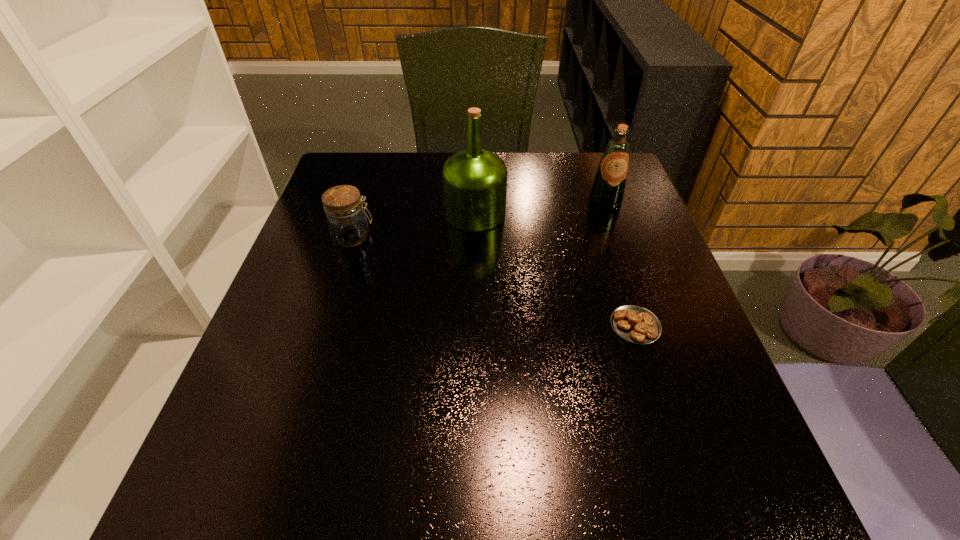
Identify which object is located as the nearest to the shortest object. Please provide its 2D coordinates. Your answer should be formatted as a tuple, i.e. [(x, y)], where the tuple contains the x and y coordinates of a point satisfying the conditions above.

[(474, 180)]

This screenshot has width=960, height=540. In order to click on vacant area in the image that satisfies the following two spatial constraints: 1. on the lid of the nearest object; 2. on the right side of the third tallest object in this screenshot , I will do `click(325, 326)`.

Locate an element on the screen. Image resolution: width=960 pixels, height=540 pixels. free space that satisfies the following two spatial constraints: 1. on the lid of the third tallest object; 2. on the right side of the shortest object is located at coordinates (325, 326).

Where is `vacant space that satisfies the following two spatial constraints: 1. on the front side of the tallest object; 2. on the right side of the pastry`? Image resolution: width=960 pixels, height=540 pixels. vacant space that satisfies the following two spatial constraints: 1. on the front side of the tallest object; 2. on the right side of the pastry is located at coordinates (474, 326).

You are a GUI agent. You are given a task and a screenshot of the screen. Output one action in this format:
    pyautogui.click(x=<x>, y=<y>)
    Task: Click on the vacant space that satisfies the following two spatial constraints: 1. on the lid of the jar; 2. on the left side of the nearest object
    
    Given the screenshot: What is the action you would take?
    pyautogui.click(x=325, y=326)

At what (x,y) coordinates should I click in order to perform the action: click on free region that satisfies the following two spatial constraints: 1. on the front-facing side of the right olive oil; 2. on the lid of the jar. Please return your answer as a coordinate pair (x, y). The width and height of the screenshot is (960, 540). Looking at the image, I should click on (617, 237).